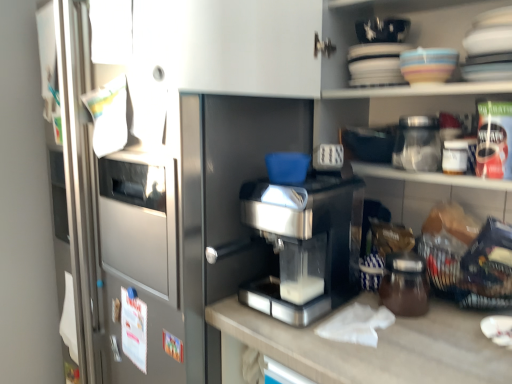
Find the location of a particular element. free point above sleek metallic coffee machine at center (from a real-world perspective) is located at coordinates (304, 183).